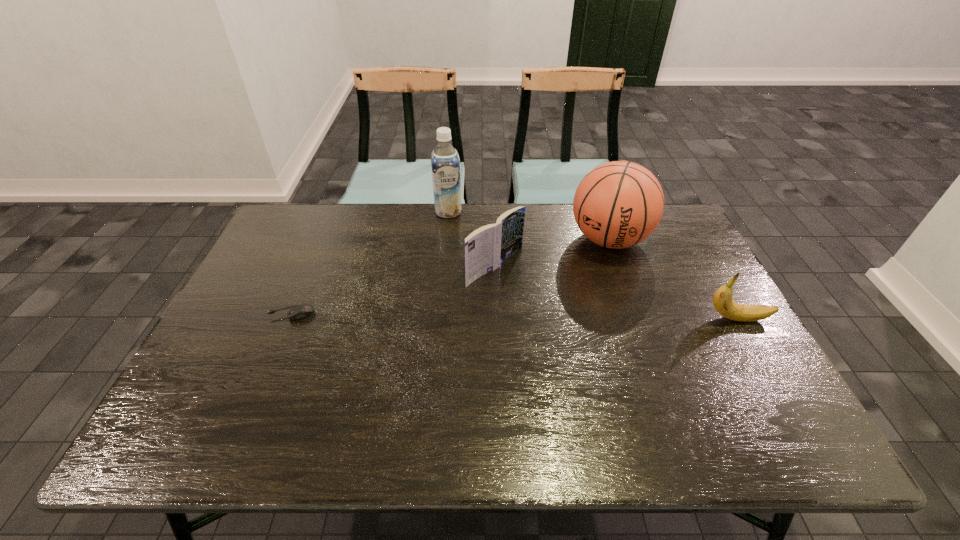
In order to click on mouse in this screenshot , I will do `click(299, 312)`.

You are a GUI agent. You are given a task and a screenshot of the screen. Output one action in this format:
    pyautogui.click(x=<x>, y=<y>)
    Task: Click on the shortest object
    The height and width of the screenshot is (540, 960).
    Given the screenshot: What is the action you would take?
    (x=299, y=312)

You are a GUI agent. You are given a task and a screenshot of the screen. Output one action in this format:
    pyautogui.click(x=<x>, y=<y>)
    Task: Click on the rightmost object
    The width and height of the screenshot is (960, 540).
    Given the screenshot: What is the action you would take?
    pyautogui.click(x=722, y=300)

This screenshot has height=540, width=960. In order to click on the third object from left to right in this screenshot , I will do `click(487, 247)`.

At what (x,y) coordinates should I click in order to perform the action: click on basketball. Please return your answer as a coordinate pair (x, y). The image size is (960, 540). Looking at the image, I should click on (619, 204).

Find the location of `soya milk`. soya milk is located at coordinates (445, 163).

Identify the location of free region located 0.100m on the left of the shortest object. The image size is (960, 540). (229, 313).

Where is `free space located on the front cover of the book`? Image resolution: width=960 pixels, height=540 pixels. free space located on the front cover of the book is located at coordinates (555, 307).

You are a GUI agent. You are given a task and a screenshot of the screen. Output one action in this format:
    pyautogui.click(x=<x>, y=<y>)
    Task: Click on the blank area located on the front cover of the book
    The height and width of the screenshot is (540, 960).
    Given the screenshot: What is the action you would take?
    pyautogui.click(x=582, y=325)

Where is `vacant space located 0.200m on the front cover of the book`? vacant space located 0.200m on the front cover of the book is located at coordinates pos(573,319).